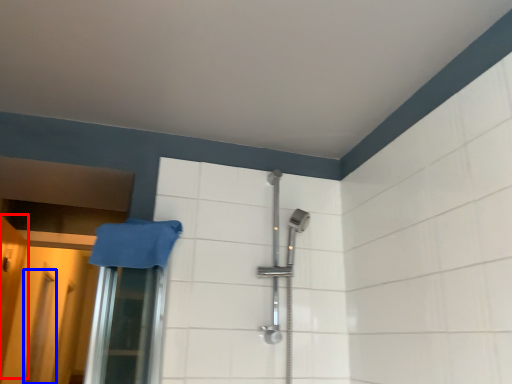
Question: Which point is closer to the camera, door (highlighted by a red box) or screen door (highlighted by a blue box)?

Choices:
 (A) door
 (B) screen door

Answer: (A)